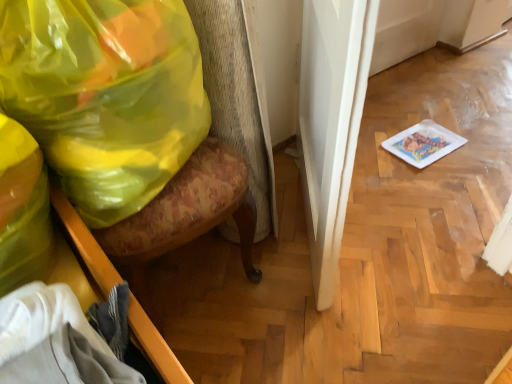
Question: Is floral fabric swivel chair at left far from translucent yellow plastic bag at left?

Choices:
 (A) yes
 (B) no

Answer: (B)

Question: Is floral fabric swivel chair at left placed right next to translucent yellow plastic bag at left?

Choices:
 (A) yes
 (B) no

Answer: (B)

Question: From the image's perspective, is floral fabric swivel chair at left on translucent yellow plastic bag at left?

Choices:
 (A) no
 (B) yes

Answer: (A)

Question: Is floral fabric swivel chair at left wider than translucent yellow plastic bag at left?

Choices:
 (A) yes
 (B) no

Answer: (A)

Question: Can translucent yellow plastic bag at left be found inside floral fabric swivel chair at left?

Choices:
 (A) yes
 (B) no

Answer: (A)

Question: Is point coord(158,6) closer or farther from the camera than point coord(259,148)?

Choices:
 (A) farther
 (B) closer

Answer: (B)

Question: From the image's perspective, is translucent yellow plastic bag at left above or below floral fabric swivel chair at left?

Choices:
 (A) above
 (B) below

Answer: (A)

Question: Is translucent yellow plastic bag at left in front of or behind floral fabric swivel chair at left in the image?

Choices:
 (A) front
 (B) behind

Answer: (B)

Question: From a real-world perspective, is translucent yellow plastic bag at left above or below floral fabric swivel chair at left?

Choices:
 (A) below
 (B) above

Answer: (B)

Question: Is wooden drawer at lower left wider or thinner than translucent yellow plastic bag at left?

Choices:
 (A) wide
 (B) thin

Answer: (B)

Question: Considering the positions of wooden drawer at lower left and translucent yellow plastic bag at left in the image, is wooden drawer at lower left taller or shorter than translucent yellow plastic bag at left?

Choices:
 (A) short
 (B) tall

Answer: (A)

Question: Would you say wooden drawer at lower left is to the left or to the right of translucent yellow plastic bag at left in the picture?

Choices:
 (A) left
 (B) right

Answer: (B)

Question: From a real-world perspective, is wooden drawer at lower left above or below translucent yellow plastic bag at left?

Choices:
 (A) above
 (B) below

Answer: (B)

Question: Is wooden drawer at lower left taller or shorter than floral fabric swivel chair at left?

Choices:
 (A) tall
 (B) short

Answer: (B)

Question: Is wooden drawer at lower left inside the boundaries of floral fabric swivel chair at left, or outside?

Choices:
 (A) outside
 (B) inside

Answer: (A)